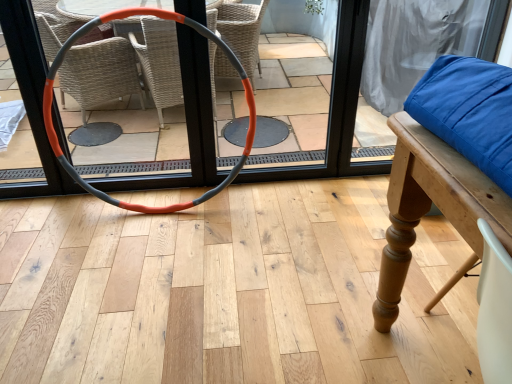
This screenshot has height=384, width=512. Find the location of `orange-gray rubber hula hoop at center`. orange-gray rubber hula hoop at center is located at coordinates [x=165, y=19].

This screenshot has width=512, height=384. What do you see at coordinates (165, 19) in the screenshot?
I see `orange-gray rubber hula hoop at center` at bounding box center [165, 19].

Locate an element on the screen. The height and width of the screenshot is (384, 512). orange rubber hoop at center is located at coordinates (337, 105).

The width and height of the screenshot is (512, 384). Describe the element at coordinates (337, 105) in the screenshot. I see `orange rubber hoop at center` at that location.

You are a GUI agent. You are given a task and a screenshot of the screen. Output one action in this format:
    pyautogui.click(x=<x>, y=<y>)
    Task: Click on the orange-gray rubber hula hoop at center
    
    Given the screenshot: What is the action you would take?
    pyautogui.click(x=165, y=19)

Would you say orange rubber hoop at center is to the left or to the right of orange-gray rubber hula hoop at center in the picture?

Clearly, orange rubber hoop at center is on the right of orange-gray rubber hula hoop at center in the image.

Is orange rubber hoop at center in front of orange-gray rubber hula hoop at center?

That is False.

Which is less distant, (348,46) or (102,195)?

Point (348,46).

From the image's perspective, is orange rubber hoop at center located above or below orange-gray rubber hula hoop at center?

From the image's perspective, orange rubber hoop at center appears above orange-gray rubber hula hoop at center.

From a real-world perspective, which is physically above, orange rubber hoop at center or orange-gray rubber hula hoop at center?

orange rubber hoop at center.

Consider the image. Considering the sizes of objects orange rubber hoop at center and orange-gray rubber hula hoop at center in the image provided, who is thinner, orange rubber hoop at center or orange-gray rubber hula hoop at center?

With smaller width is orange rubber hoop at center.

Who is shorter, orange rubber hoop at center or orange-gray rubber hula hoop at center?

orange-gray rubber hula hoop at center.

Which of these two, orange rubber hoop at center or orange-gray rubber hula hoop at center, is bigger?

With larger size is orange-gray rubber hula hoop at center.

Is orange-gray rubber hula hoop at center surrounded by orange rubber hoop at center?

Definitely not — orange-gray rubber hula hoop at center is not inside orange rubber hoop at center.

Is orange rubber hoop at center beside orange-gray rubber hula hoop at center?

There is a gap between orange rubber hoop at center and orange-gray rubber hula hoop at center.

Is orange rubber hoop at center facing towards orange-gray rubber hula hoop at center?

Yes, orange rubber hoop at center is aimed at orange-gray rubber hula hoop at center.

Can you tell me how much orange rubber hoop at center and orange-gray rubber hula hoop at center differ in facing direction?

5.27 degrees separate the facing orientations of orange rubber hoop at center and orange-gray rubber hula hoop at center.

How distant is orange rubber hoop at center from orange-gray rubber hula hoop at center?

The distance of orange rubber hoop at center from orange-gray rubber hula hoop at center is 22.34 centimeters.

This screenshot has height=384, width=512. I want to click on hula hoop in front of the orange rubber hoop at center, so click(165, 19).

Considering the relative positions of orange-gray rubber hula hoop at center and orange rubber hoop at center in the image provided, is orange-gray rubber hula hoop at center to the right of orange rubber hoop at center from the viewer's perspective?

Incorrect, orange-gray rubber hula hoop at center is not on the right side of orange rubber hoop at center.

Between orange-gray rubber hula hoop at center and orange rubber hoop at center, which one is positioned in front?

orange-gray rubber hula hoop at center is in front.

Considering the points (58, 57) and (343, 83), which point is in front, point (58, 57) or point (343, 83)?

The point (58, 57) is closer.

From the image's perspective, is orange-gray rubber hula hoop at center located beneath orange rubber hoop at center?

Yes, from the image's perspective, orange-gray rubber hula hoop at center is beneath orange rubber hoop at center.

From a real-world perspective, between orange-gray rubber hula hoop at center and orange rubber hoop at center, who is vertically lower?

In real-world perspective, orange-gray rubber hula hoop at center is lower.

Considering the relative sizes of orange-gray rubber hula hoop at center and orange rubber hoop at center in the image provided, is orange-gray rubber hula hoop at center wider than orange rubber hoop at center?

Correct, the width of orange-gray rubber hula hoop at center exceeds that of orange rubber hoop at center.

Can you confirm if orange-gray rubber hula hoop at center is shorter than orange rubber hoop at center?

Yes.

Can you confirm if orange-gray rubber hula hoop at center is bigger than orange rubber hoop at center?

Correct, orange-gray rubber hula hoop at center is larger in size than orange rubber hoop at center.

Do you think orange-gray rubber hula hoop at center is within orange rubber hoop at center, or outside of it?

orange-gray rubber hula hoop at center exists outside the volume of orange rubber hoop at center.

Is orange-gray rubber hula hoop at center positioned far away from orange rubber hoop at center?

No, orange-gray rubber hula hoop at center is in close proximity to orange rubber hoop at center.

Could you tell me if orange-gray rubber hula hoop at center is turned towards orange rubber hoop at center?

No, orange-gray rubber hula hoop at center does not turn towards orange rubber hoop at center.

What's the angular difference between orange-gray rubber hula hoop at center and orange rubber hoop at center's facing directions?

5.27 degrees separate the facing orientations of orange-gray rubber hula hoop at center and orange rubber hoop at center.

Measure the distance between orange-gray rubber hula hoop at center and orange rubber hoop at center.

A distance of 8.79 inches exists between orange-gray rubber hula hoop at center and orange rubber hoop at center.

This screenshot has width=512, height=384. In order to click on hula hoop in front of the orange rubber hoop at center in this screenshot , I will do `click(165, 19)`.

The height and width of the screenshot is (384, 512). Identify the location of screen door above the orange-gray rubber hula hoop at center (from the image's perspective). (337, 105).

Locate an element on the screen. hula hoop below the orange rubber hoop at center (from the image's perspective) is located at coordinates [165, 19].